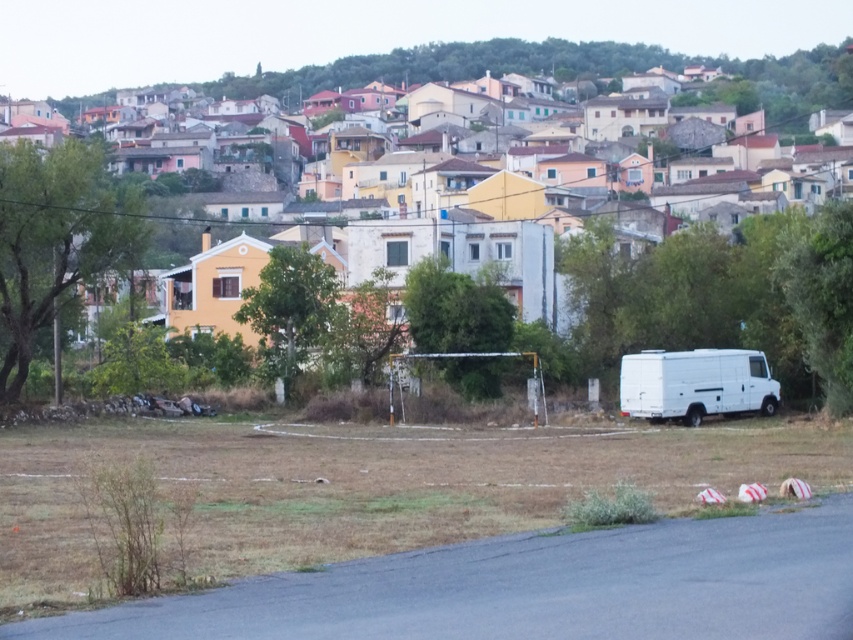
Question: Among these objects, which one is nearest to the camera?

Choices:
 (A) white matte van at center
 (B) white matte van at right

Answer: (A)

Question: Is white matte van at center below white matte van at right?

Choices:
 (A) yes
 (B) no

Answer: (B)

Question: Does white matte van at center have a greater width compared to white matte van at right?

Choices:
 (A) no
 (B) yes

Answer: (B)

Question: Does white matte van at center appear under white matte van at right?

Choices:
 (A) yes
 (B) no

Answer: (B)